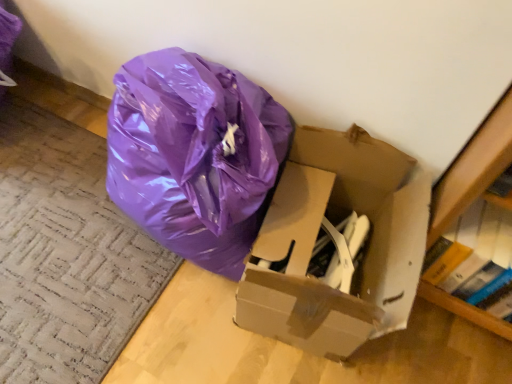
This screenshot has width=512, height=384. What do you see at coordinates (319, 243) in the screenshot?
I see `cardboard box at center` at bounding box center [319, 243].

Locate an element on the screen. Image resolution: width=512 pixels, height=384 pixels. cardboard box at center is located at coordinates point(319,243).

Image resolution: width=512 pixels, height=384 pixels. What do you see at coordinates (476, 260) in the screenshot?
I see `hardcover book at right` at bounding box center [476, 260].

At what (x,y) coordinates should I click in order to perform the action: click on hardcover book at right. Please return your answer as a coordinate pair (x, y). Image resolution: width=512 pixels, height=384 pixels. Looking at the image, I should click on (476, 260).

The image size is (512, 384). I want to click on cardboard box at center, so click(x=319, y=243).

Between hardcover book at right and cardboard box at center, which one appears on the right side from the viewer's perspective?

Positioned to the right is hardcover book at right.

Which object is further away from the camera, hardcover book at right or cardboard box at center?

hardcover book at right.

Does point (508, 317) come behind point (389, 257)?

Yes, point (508, 317) is behind point (389, 257).

From the image's perspective, which is below, hardcover book at right or cardboard box at center?

hardcover book at right, from the image's perspective.

Based on the photo, from a real-world perspective, is hardcover book at right physically above cardboard box at center?

Yes, from a real-world perspective, hardcover book at right is above cardboard box at center.

Is hardcover book at right wider than cardboard box at center?

In fact, hardcover book at right might be narrower than cardboard box at center.

Considering the relative sizes of hardcover book at right and cardboard box at center in the image provided, is hardcover book at right taller than cardboard box at center?

Incorrect, the height of hardcover book at right is not larger of that of cardboard box at center.

Considering the sizes of hardcover book at right and cardboard box at center in the image, is hardcover book at right bigger or smaller than cardboard box at center?

hardcover book at right is smaller than cardboard box at center.

Do you think hardcover book at right is within cardboard box at center, or outside of it?

hardcover book at right is not enclosed by cardboard box at center.

Based on the photo, would you say hardcover book at right is a long distance from cardboard box at center?

No, hardcover book at right is not far away from cardboard box at center.

Is hardcover book at right oriented towards cardboard box at center?

No, hardcover book at right is not oriented towards cardboard box at center.

How much distance is there between hardcover book at right and cardboard box at center?

hardcover book at right and cardboard box at center are 10.25 inches apart.

Identify the location of box in front of the hardcover book at right. (319, 243).

Based on the photo, which is more to the left, cardboard box at center or hardcover book at right?

From the viewer's perspective, cardboard box at center appears more on the left side.

Looking at this image, does cardboard box at center come behind hardcover book at right?

No, cardboard box at center is closer to the viewer.

Considering the positions of points (385, 184) and (459, 220), is point (385, 184) farther from camera compared to point (459, 220)?

Yes, point (385, 184) is farther from viewer.

From the image's perspective, which is above, cardboard box at center or hardcover book at right?

cardboard box at center is shown above in the image.

Consider the image. From a real-world perspective, which is physically above, cardboard box at center or hardcover book at right?

hardcover book at right is physically above.

Is cardboard box at center wider or thinner than hardcover book at right?

Considering their sizes, cardboard box at center looks broader than hardcover book at right.

Considering the relative sizes of cardboard box at center and hardcover book at right in the image provided, is cardboard box at center taller than hardcover book at right?

Correct, cardboard box at center is much taller as hardcover book at right.

Does cardboard box at center have a larger size compared to hardcover book at right?

Correct, cardboard box at center is larger in size than hardcover book at right.

Can we say cardboard box at center lies outside hardcover book at right?

Yes.

Is cardboard box at center far away from hardcover book at right?

cardboard box at center is near hardcover book at right, not far away.

Could you tell me if cardboard box at center is facing hardcover book at right?

No, cardboard box at center is not oriented towards hardcover book at right.

How different are the orientations of cardboard box at center and hardcover book at right in degrees?

The angle between the facing direction of cardboard box at center and the facing direction of hardcover book at right is 8.81 degrees.

Where is `box in front of the hardcover book at right`? box in front of the hardcover book at right is located at coordinates (319, 243).

Where is `book behind the cardboard box at center`? This screenshot has height=384, width=512. book behind the cardboard box at center is located at coordinates (476, 260).

I want to click on box in front of the hardcover book at right, so (x=319, y=243).